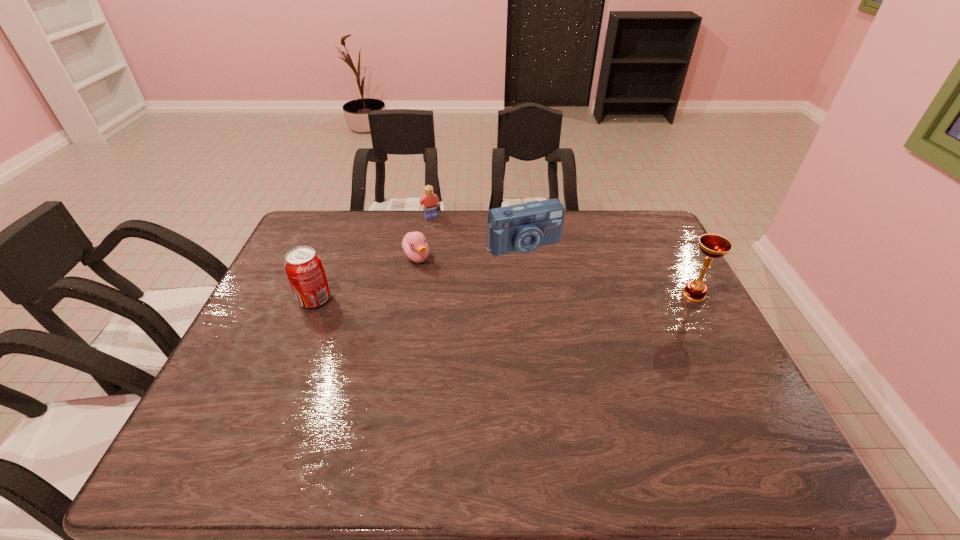
I want to click on object situated at the right edge, so click(x=713, y=246).

Where is `vacant space at the far edge`? The height and width of the screenshot is (540, 960). vacant space at the far edge is located at coordinates (607, 222).

I want to click on vacant space at the near edge of the desktop, so click(x=463, y=418).

Find the location of a particular element. blank space at the right edge of the desktop is located at coordinates (655, 284).

This screenshot has height=540, width=960. Find the location of `vacant space at the far left corner of the desktop`. vacant space at the far left corner of the desktop is located at coordinates (305, 245).

Locate an element on the screen. vacant point at the far right corner is located at coordinates (x=648, y=224).

Image resolution: width=960 pixels, height=540 pixels. I want to click on unoccupied area between the chalice and the leftmost object, so click(504, 297).

What are the coordinates of `unoccupied position between the chalice and the camera` in the screenshot? It's located at (609, 270).

Image resolution: width=960 pixels, height=540 pixels. Find the location of `unoccupied position between the soda and the rightmost object`. unoccupied position between the soda and the rightmost object is located at coordinates (504, 297).

Identify the location of vacant point located between the rightmost object and the soda. This screenshot has height=540, width=960. (504, 297).